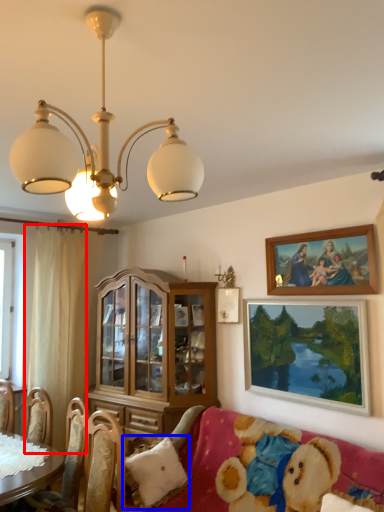
Question: Which point is closer to the camera, curtain (highlighted by a red box) or pillow (highlighted by a blue box)?

Choices:
 (A) curtain
 (B) pillow

Answer: (B)